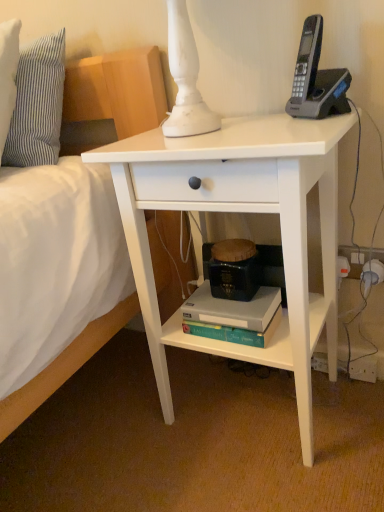
Locate an element on the screen. The width and height of the screenshot is (384, 512). empty space that is ontop of teal matte paperback book at lower center (from a real-world perspective) is located at coordinates (230, 298).